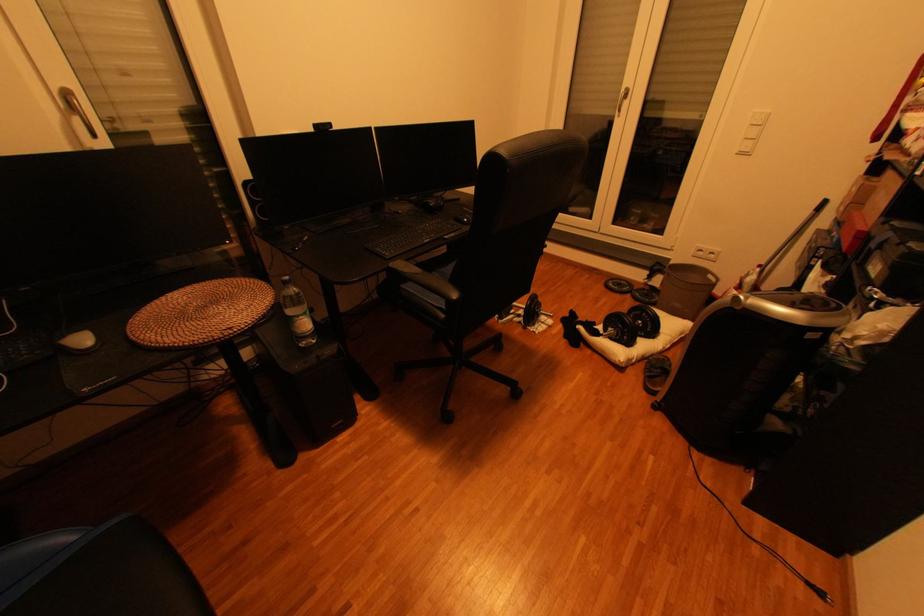
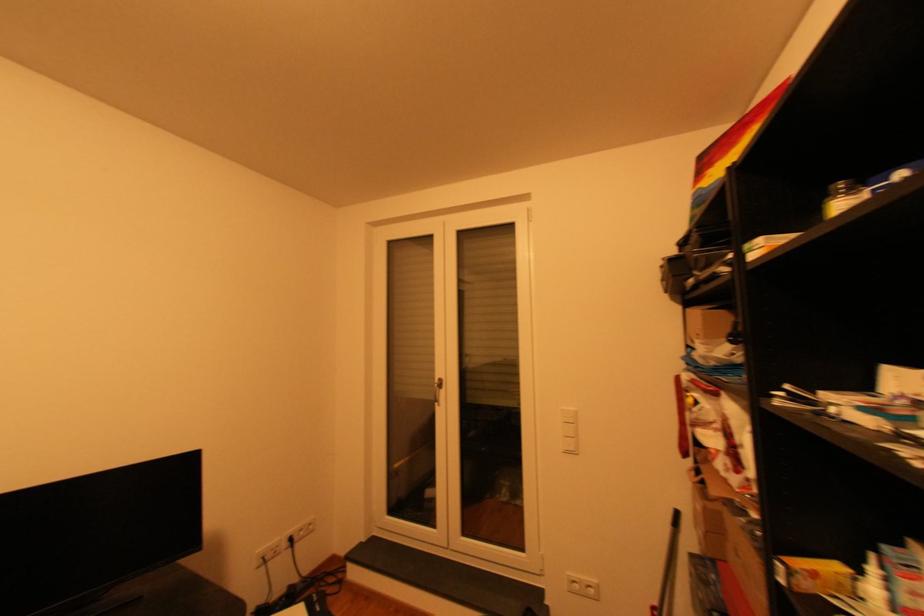
How did the camera likely rotate?

The rotation direction of the camera is right-up.